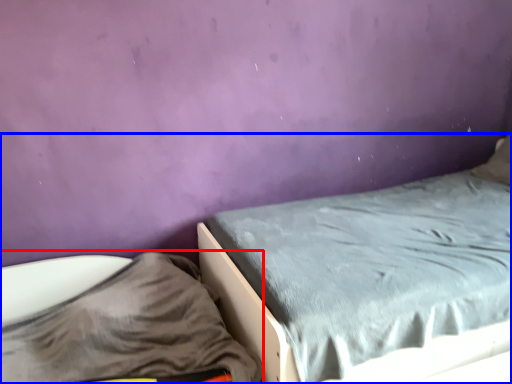
Question: Among these objects, which one is farthest to the camera, sheet (highlighted by a red box) or bed (highlighted by a blue box)?

Choices:
 (A) sheet
 (B) bed

Answer: (B)